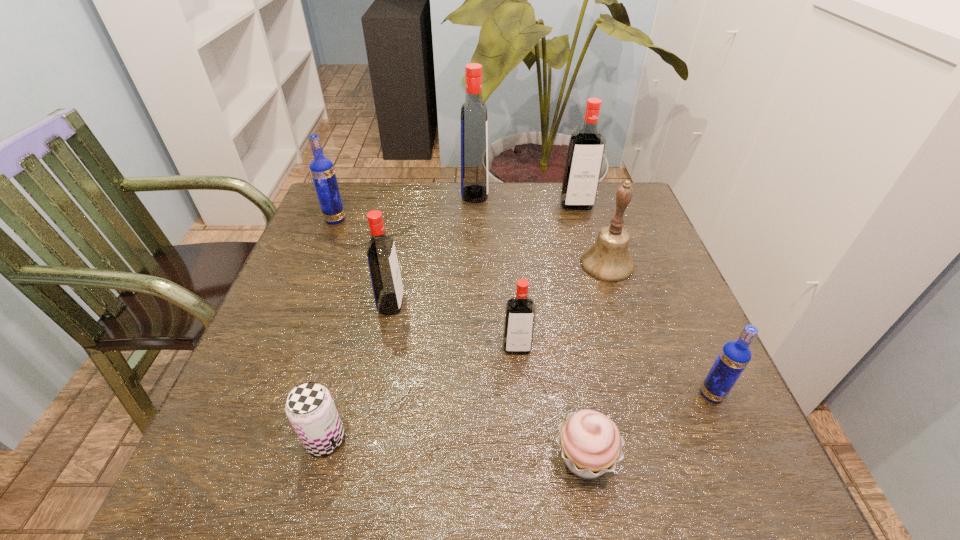
The height and width of the screenshot is (540, 960). Identify the location of vacant point at the near right corner. [x=710, y=464].

Find the location of `vacant point located between the leftmost vodka and the pink cupcake`. vacant point located between the leftmost vodka and the pink cupcake is located at coordinates (460, 338).

Image resolution: width=960 pixels, height=540 pixels. Find the location of `empty space between the fifth farthest object and the eighth object from right to left`. empty space between the fifth farthest object and the eighth object from right to left is located at coordinates (358, 372).

Find the location of a particular element. free space that is in between the farther blue vodka and the eighth object from right to left is located at coordinates (330, 329).

I want to click on vacant space that is in between the third nearest vodka and the seventh farthest object, so click(552, 349).

The image size is (960, 540). I want to click on vacant point located between the second biggest red vodka and the fifth farthest object, so [484, 255].

Where is `vacant region between the nearer blue vodka and the second vodka from left to right`? vacant region between the nearer blue vodka and the second vodka from left to right is located at coordinates (552, 349).

Locate an element on the screen. This screenshot has height=540, width=960. unoccupied position between the eighth shortest object and the sixth nearest object is located at coordinates (591, 235).

You are a GUI agent. You are given a task and a screenshot of the screen. Output one action in this format:
    pyautogui.click(x=<x>, y=<y>)
    Task: Click on the unoccupied area between the fifth object from right to left and the cupcake
    Image resolution: width=960 pixels, height=540 pixels.
    Given the screenshot: What is the action you would take?
    pyautogui.click(x=551, y=402)

Identify the location of unoccupied area between the third object from left to right and the sixth object from left to right. (488, 381).